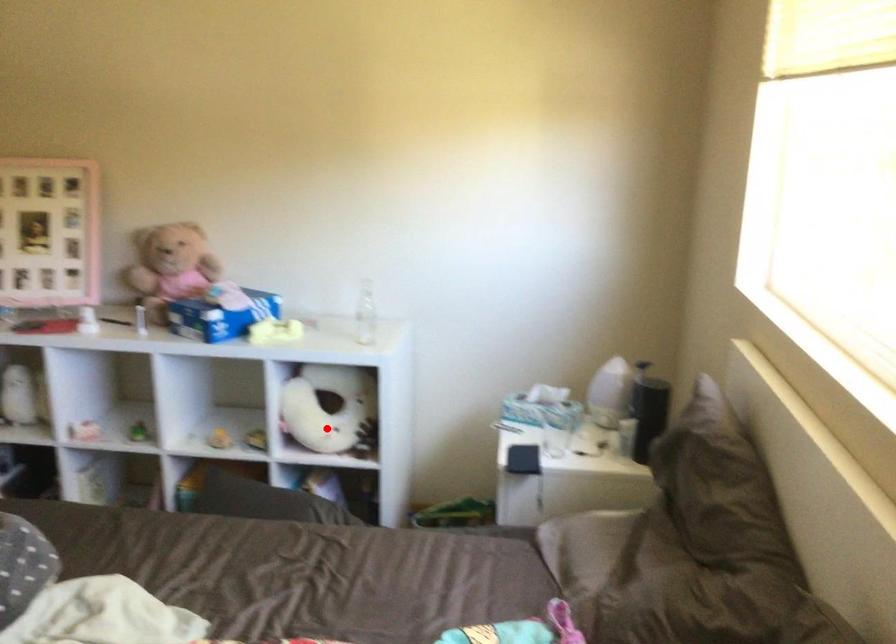
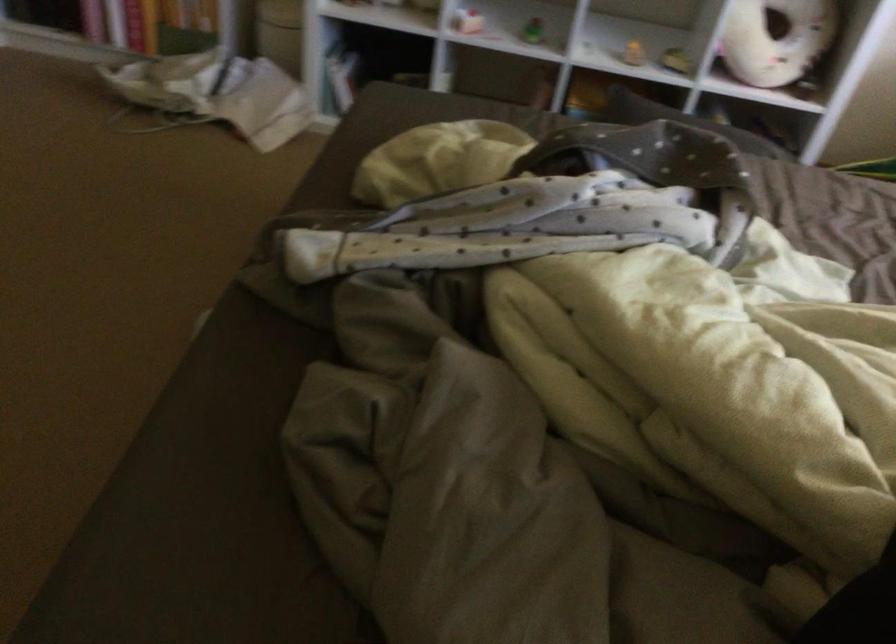
Question: I am providing you with two images of the same scene from different viewpoints. A red point is shown in image1. For the corresponding object point in image2, is it positioned nearer or farther from the camera?

Choices:
 (A) Nearer
 (B) Farther

Answer: (A)